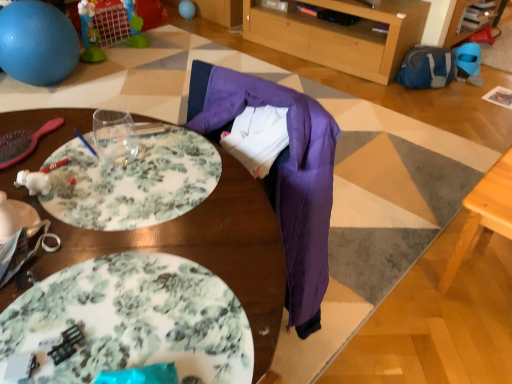
Question: Does point (37, 218) appear closer or farther from the camera than point (505, 183)?

Choices:
 (A) closer
 (B) farther

Answer: (A)

Question: In terms of height, does white glossy plate at lower left, which is counted as the second plate, starting from the right, look taller or shorter compared to light wood table at lower right, marked as the 2th table in a left-to-right arrangement?

Choices:
 (A) short
 (B) tall

Answer: (A)

Question: Considering the real-world distances, which object is farthest from the wooden table at center, positioned as the 2th table in right-to-left order?

Choices:
 (A) light wood table at lower right, the 1th table viewed from the right
 (B) floral ceramic plate at lower left, marked as the 1th plate in a bottom-to-top arrangement
 (C) white glossy plate at lower left, the 1th plate in the top-to-bottom sequence
 (D) blue rubber ball at upper left
 (E) matte blue balloon at upper center

Answer: (E)

Question: Which object is positioned closest to the blue rubber ball at upper left?

Choices:
 (A) floral ceramic plate at lower left, the 2th plate viewed from the top
 (B) matte blue balloon at upper center
 (C) light wood table at lower right, marked as the 2th table in a left-to-right arrangement
 (D) white glossy plate at lower left, marked as the second plate in a bottom-to-top arrangement
 (E) wooden table at center, positioned as the 2th table in right-to-left order

Answer: (B)